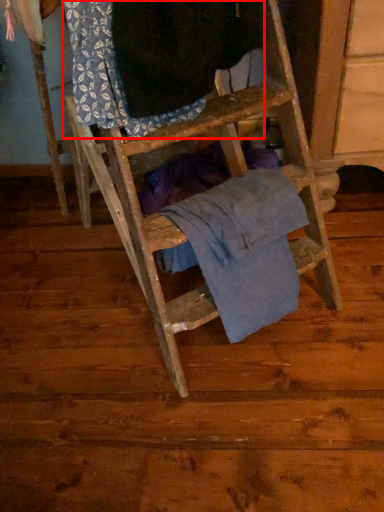
Question: From the image's perspective, what is the correct spatial relationship of clothing (annotated by the red box) in relation to clothing?

Choices:
 (A) below
 (B) above

Answer: (B)